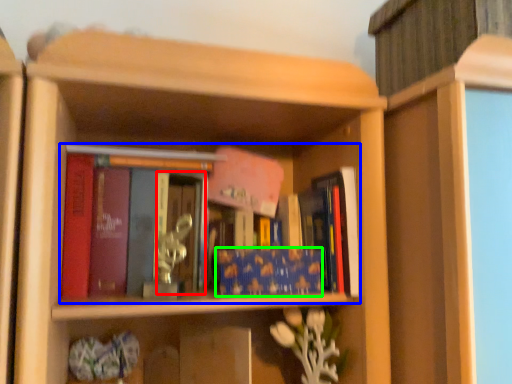
Question: Estimate the real-world distances between objects in this image. Which object is closer to glass door (highlighted by a red box), book (highlighted by a blue box) or book (highlighted by a green box)?

Choices:
 (A) book
 (B) book

Answer: (A)